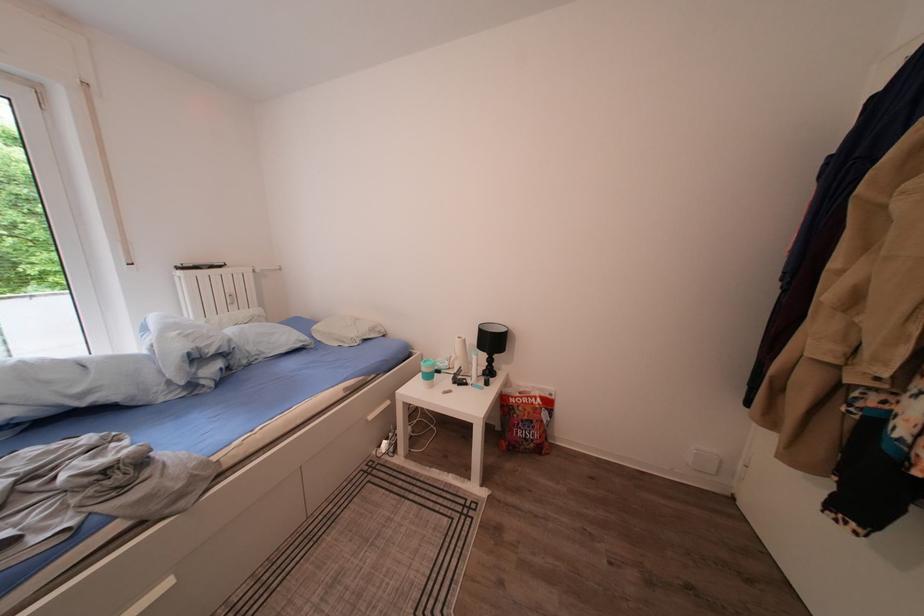
Identify the location of red plastic bag. (525, 418).